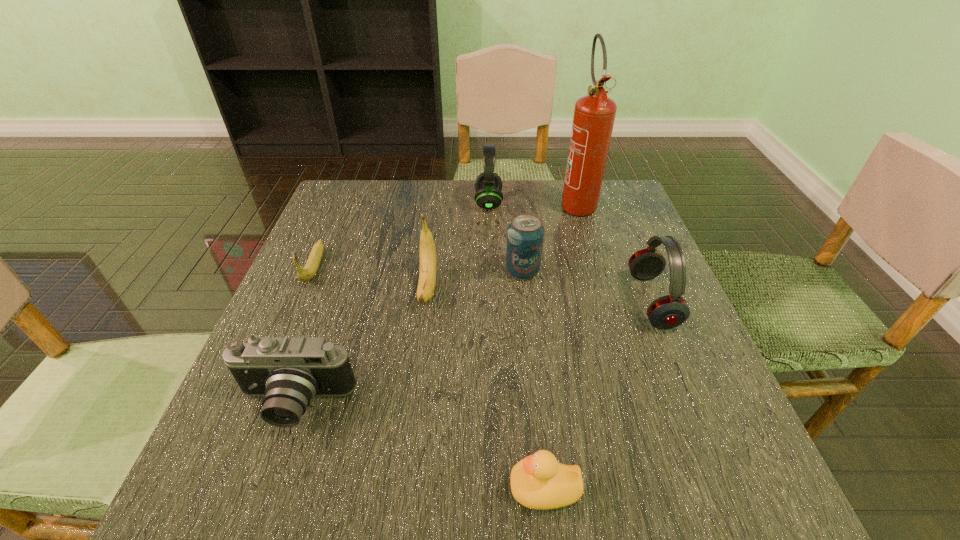
Where is `object that ranks as the fourth closest to the duck`? The height and width of the screenshot is (540, 960). object that ranks as the fourth closest to the duck is located at coordinates (525, 234).

Identify the location of blank area in the image that satisfies the following two spatial constraints: 1. from the nozzle of the tallest object; 2. on the ear cups of the headset. Image resolution: width=960 pixels, height=540 pixels. (577, 202).

At what (x,y) coordinates should I click in order to perform the action: click on vacant space that satisfies the following two spatial constraints: 1. on the ear cups of the headset; 2. on the front-facing side of the camera. Please return your answer as a coordinate pair (x, y). Image resolution: width=960 pixels, height=540 pixels. Looking at the image, I should click on (493, 404).